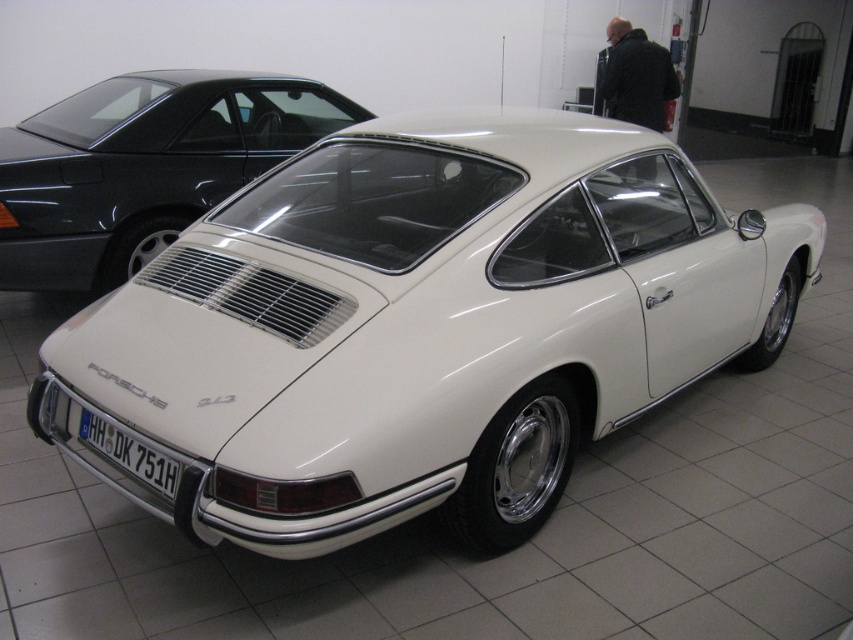
Which is more to the left, white glossy car at center or white glossy porsche at center?

From the viewer's perspective, white glossy porsche at center appears more on the left side.

Who is more distant from viewer, (491, 433) or (149, 88)?

Point (149, 88)

At what (x,y) coordinates should I click in order to perform the action: click on white glossy car at center. Please return your answer as a coordinate pair (x, y). Looking at the image, I should click on (421, 326).

Can you confirm if white glossy porsche at center is shorter than white plastic license plate at center?

Incorrect, white glossy porsche at center's height does not fall short of white plastic license plate at center's.

Which is in front, point (288, 122) or point (152, 484)?

Point (152, 484) is in front.

Is point (149, 161) positioned in front of point (161, 490)?

That is False.

The image size is (853, 640). What are the coordinates of `white glossy porsche at center` in the screenshot? It's located at (142, 166).

Is white glossy car at center positioned at the back of white plastic license plate at center?

No, white glossy car at center is in front of white plastic license plate at center.

This screenshot has width=853, height=640. What do you see at coordinates (421, 326) in the screenshot?
I see `white glossy car at center` at bounding box center [421, 326].

I want to click on white glossy car at center, so click(421, 326).